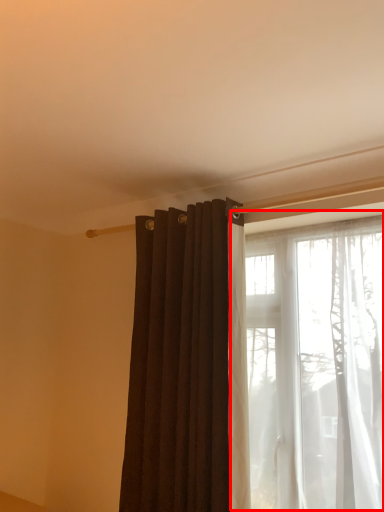
Question: In this image, where is window (annotated by the red box) located relative to curtain?

Choices:
 (A) left
 (B) right

Answer: (B)